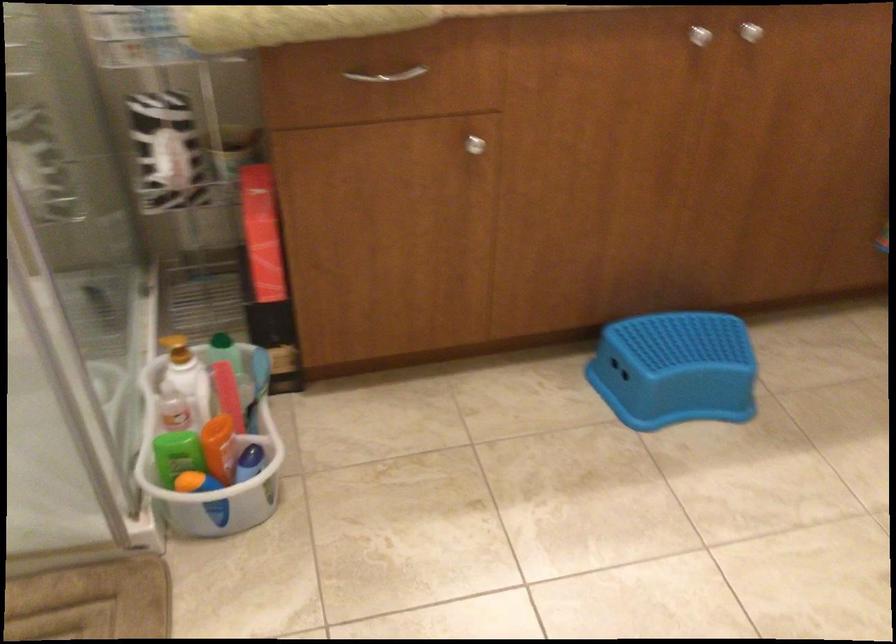
The height and width of the screenshot is (644, 896). Describe the element at coordinates (264, 263) in the screenshot. I see `the orange pump dispenser` at that location.